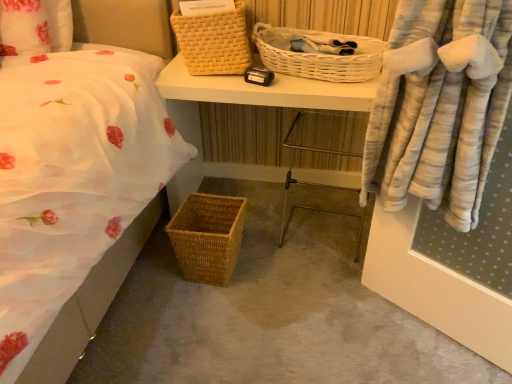
You are a GUI agent. You are given a task and a screenshot of the screen. Output one action in this format:
    pyautogui.click(x=<x>, y=<y>)
    Task: Click on the free space in front of woven brown picnic basket at lower left, the first picnic basket positioned from the bottom
    Image resolution: width=512 pixels, height=384 pixels.
    Given the screenshot: What is the action you would take?
    pyautogui.click(x=202, y=313)